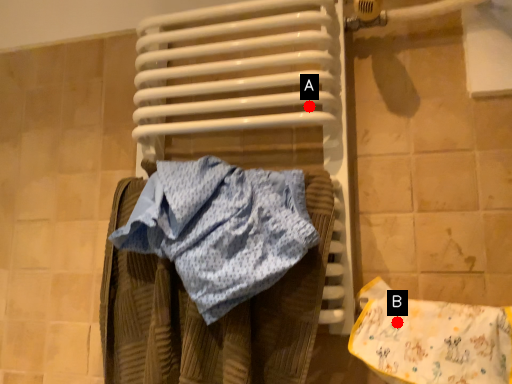
Question: Two points are circled on the image, labeled by A and B beside each circle. Among these points, which one is farthest from the camera?

Choices:
 (A) A is further
 (B) B is further

Answer: (A)